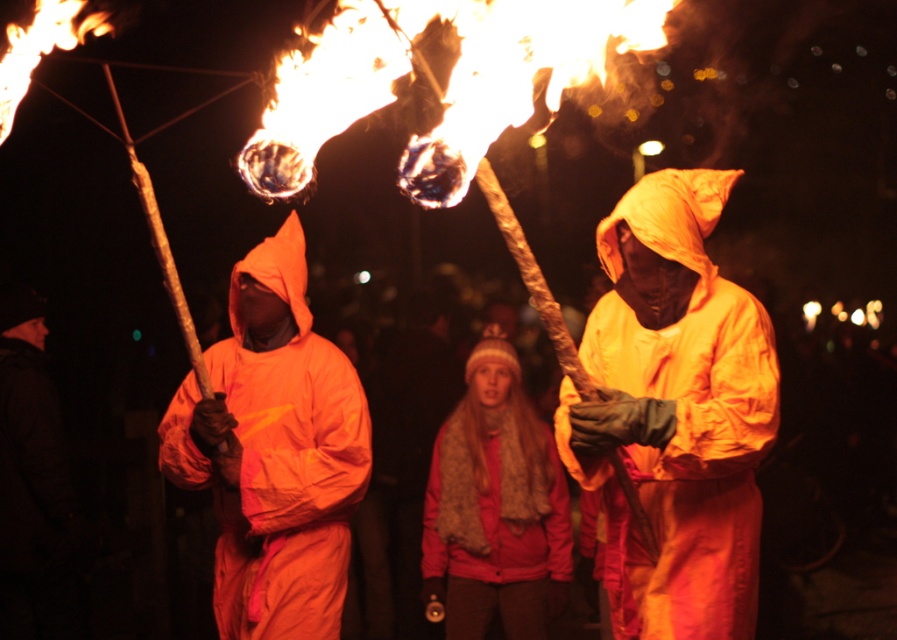
Is the position of matte yellow robe at center more distant than that of orange matte/soft robe at left?

That is False.

Is matte yellow robe at center shorter than orange matte/soft robe at left?

Yes, matte yellow robe at center is shorter than orange matte/soft robe at left.

Does point (637, 388) come farther from viewer compared to point (293, 324)?

No.

In order to click on matte yellow robe at center in this screenshot , I will do `click(675, 412)`.

Who is shorter, matte yellow robe at center or knitted woolen hat at center?

Standing shorter between the two is knitted woolen hat at center.

Between matte yellow robe at center and knitted woolen hat at center, which one has more height?

Standing taller between the two is matte yellow robe at center.

Who is more distant from viewer, (716, 460) or (492, 506)?

The point (492, 506) is behind.

Locate an element on the screen. matte yellow robe at center is located at coordinates (675, 412).

In the scene shown: Does orange matte/soft robe at left come in front of knitted woolen hat at center?

Yes.

Where is `orange matte/soft robe at left`? Image resolution: width=897 pixels, height=640 pixels. orange matte/soft robe at left is located at coordinates (274, 452).

This screenshot has height=640, width=897. Identify the location of orange matte/soft robe at left. (274, 452).